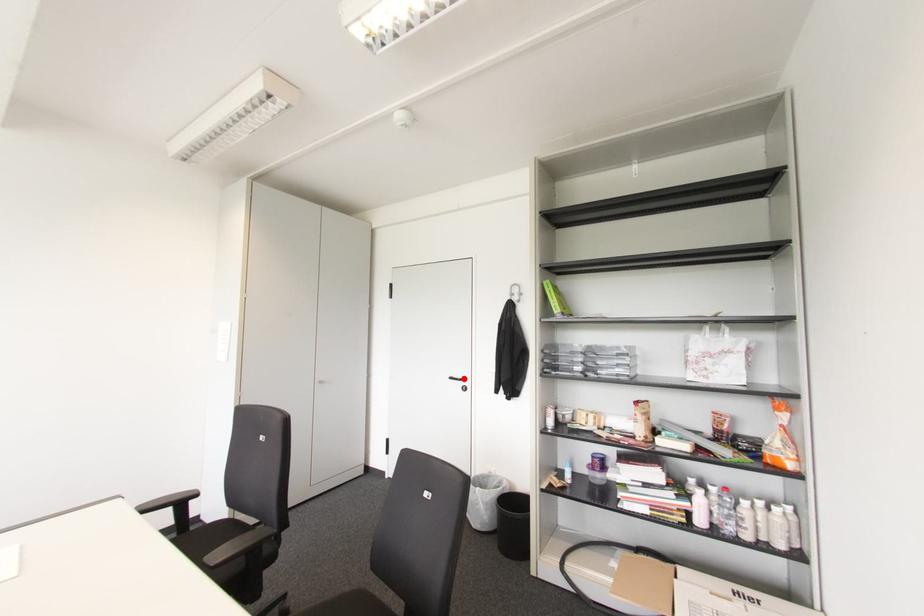
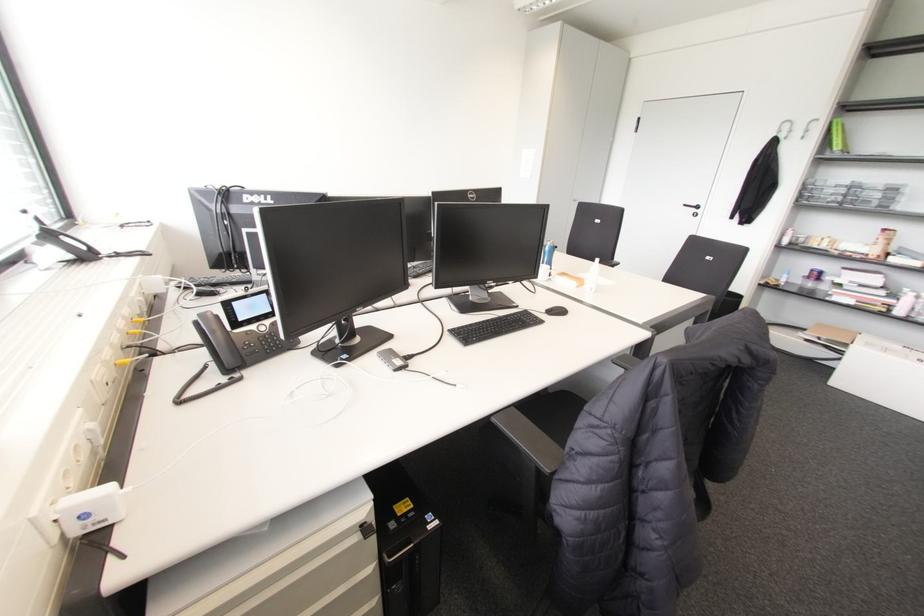
The point at the highlighted location is marked in the first image. Where is the corresponding point in the second image?

(697, 207)